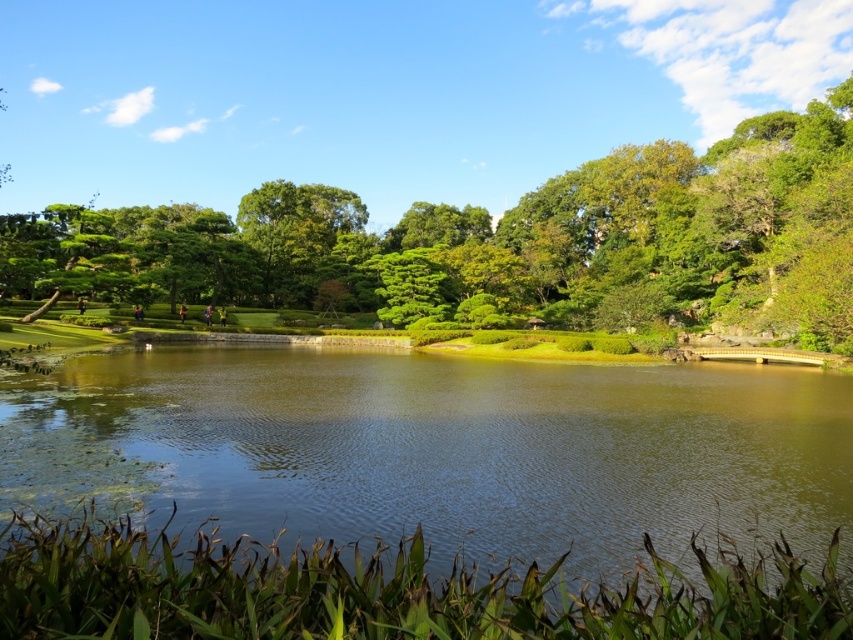
Based on the coordinates provided, which object in the scene is located at point (422,497)?

The point (422,497) corresponds to the green grassy lake at center.

You are standing in the garden and want to take a photo of both point [10,608] and point [798,243]. Which point will appear larger in your camera view?

Point [10,608] is closer to the camera than point [798,243], so it will appear larger in the photo.